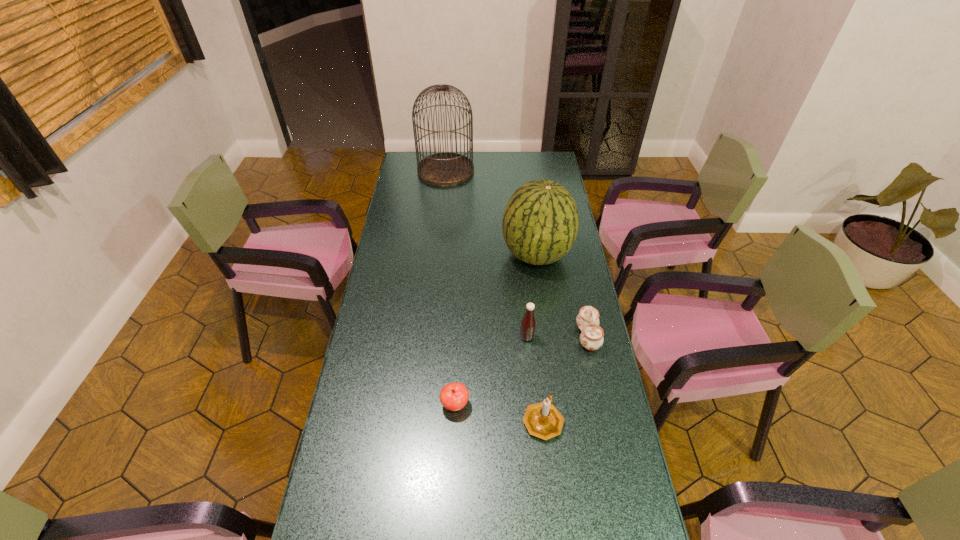
Where is `free space between the watermelon and the candle holder`? free space between the watermelon and the candle holder is located at coordinates (540, 338).

Identify the location of vacant region between the candle holder and the shortest object. This screenshot has height=540, width=960. (499, 413).

What are the coordinates of `free space between the second shortest object and the Tabasco sauce` in the screenshot? It's located at (558, 337).

This screenshot has height=540, width=960. In order to click on object that stands as the fourth closest to the Tabasco sauce in this screenshot , I will do `click(454, 396)`.

This screenshot has width=960, height=540. Find the location of `object that stands as the closest to the farthest object`. object that stands as the closest to the farthest object is located at coordinates (540, 223).